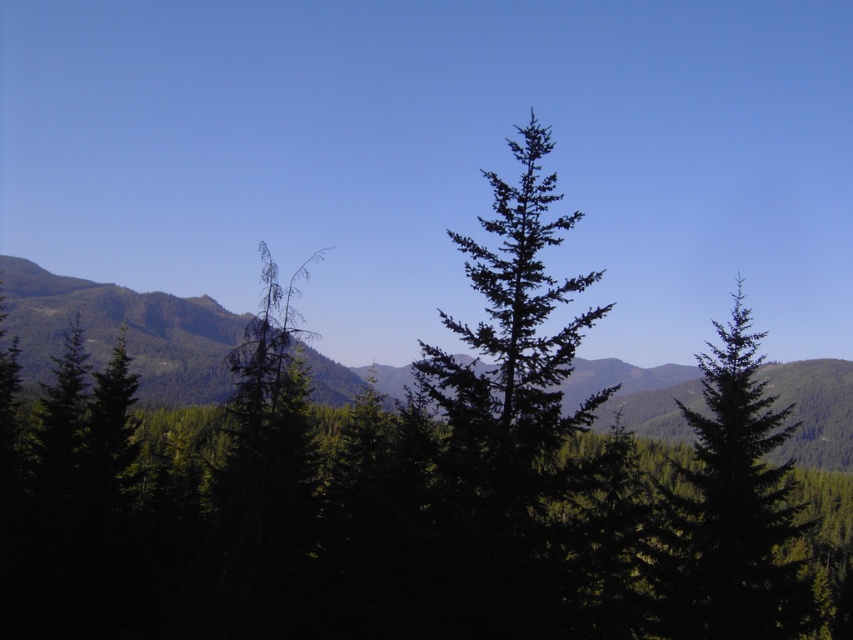
Question: Which point is farther to the camera?

Choices:
 (A) green matte tree at center
 (B) green textured forest at center

Answer: (B)

Question: Which object is closer to the camera taking this photo?

Choices:
 (A) green textured forest at center
 (B) green matte tree at center

Answer: (B)

Question: Is green textured forest at center behind green matte tree at center?

Choices:
 (A) no
 (B) yes

Answer: (B)

Question: Is green textured forest at center bigger than green matte tree at center?

Choices:
 (A) no
 (B) yes

Answer: (B)

Question: Does green textured forest at center appear under green matte tree at center?

Choices:
 (A) yes
 (B) no

Answer: (B)